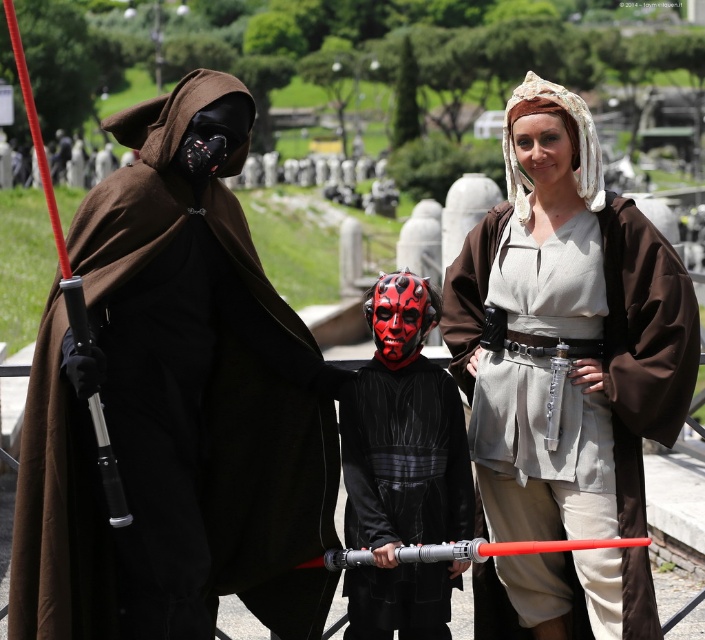
Question: Based on their relative distances, which object is nearer to the matte brown robe at center?

Choices:
 (A) black velvet robe at center
 (B) brown matte robe at left

Answer: (A)

Question: Is brown matte robe at left positioned at the back of matte brown robe at center?

Choices:
 (A) yes
 (B) no

Answer: (B)

Question: Which object is the closest to the brown matte robe at left?

Choices:
 (A) black velvet robe at center
 (B) matte brown robe at center

Answer: (A)

Question: Observing the image, what is the correct spatial positioning of brown matte robe at left in reference to matte brown robe at center?

Choices:
 (A) below
 (B) above

Answer: (B)

Question: Observing the image, what is the correct spatial positioning of brown matte robe at left in reference to black velvet robe at center?

Choices:
 (A) below
 (B) above

Answer: (B)

Question: Which object appears farthest from the camera in this image?

Choices:
 (A) brown matte robe at left
 (B) matte brown robe at center
 (C) black velvet robe at center

Answer: (B)